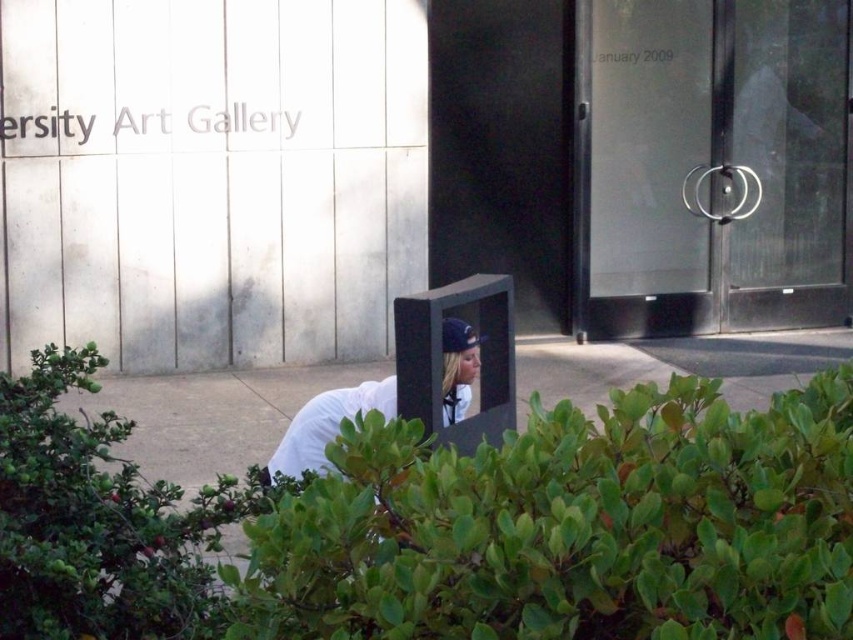
Question: Which is farther from the green leafy bush at lower center?

Choices:
 (A) transparent glass door at center right
 (B) white matte shirt at lower center
 (C) green leafy bush at lower left

Answer: (A)

Question: Based on their relative distances, which object is farther from the transparent glass door at center right?

Choices:
 (A) green leafy bush at lower center
 (B) green leafy bush at lower left

Answer: (A)

Question: Can you confirm if green leafy bush at lower left is thinner than white matte shirt at lower center?

Choices:
 (A) no
 (B) yes

Answer: (A)

Question: Among these objects, which one is nearest to the camera?

Choices:
 (A) green leafy bush at lower center
 (B) white matte shirt at lower center
 (C) transparent glass door at center right

Answer: (A)

Question: From the image, what is the correct spatial relationship of transparent glass door at center right in relation to green leafy bush at lower left?

Choices:
 (A) below
 (B) above

Answer: (B)

Question: Can you confirm if transparent glass door at center right is wider than white matte shirt at lower center?

Choices:
 (A) yes
 (B) no

Answer: (A)